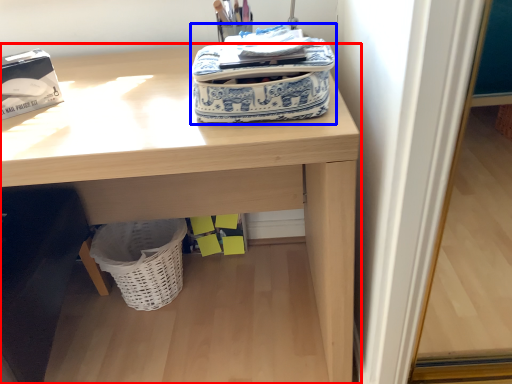
Question: Which object is further to the camera taking this photo, desk (highlighted by a red box) or bag (highlighted by a blue box)?

Choices:
 (A) desk
 (B) bag

Answer: (A)